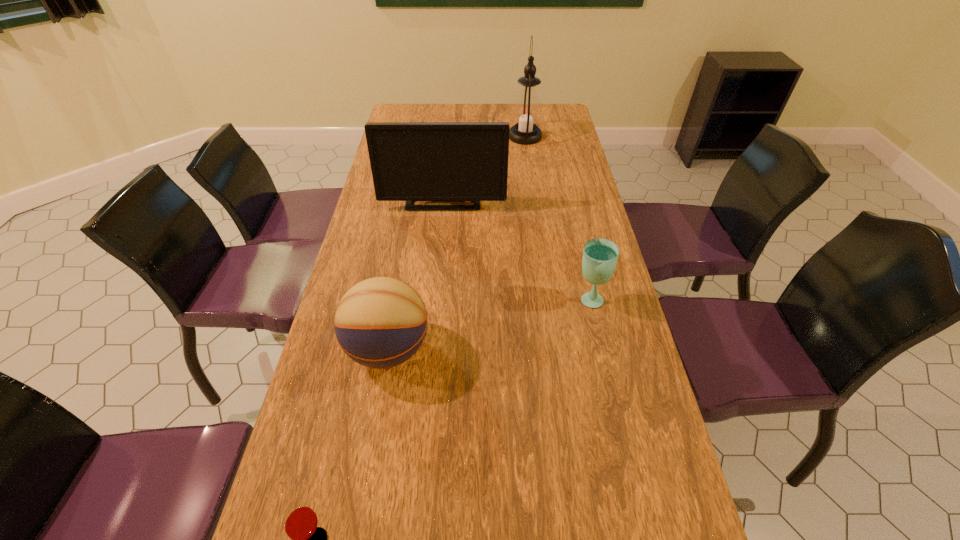
Locate an element on the screen. This screenshot has width=960, height=540. free space located on the left of the right glass is located at coordinates (479, 299).

Where is `object present at the far edge`? object present at the far edge is located at coordinates (527, 110).

This screenshot has height=540, width=960. Find the location of `computer monitor present at the left edge`. computer monitor present at the left edge is located at coordinates (410, 161).

I want to click on basketball located in the left edge section of the desktop, so click(x=381, y=322).

You are a GUI agent. You are given a task and a screenshot of the screen. Output one action in this format:
    pyautogui.click(x=<x>, y=<y>)
    Task: Click on the oil lamp located in the right edge section of the desktop
    This screenshot has width=960, height=540.
    Given the screenshot: What is the action you would take?
    pyautogui.click(x=527, y=110)

Find the location of a particular element. This screenshot has width=960, height=540. glass at the right edge is located at coordinates (600, 256).

The image size is (960, 540). I want to click on object present at the far right corner, so (527, 110).

What are the coordinates of `free space at the far edge of the desktop` in the screenshot? It's located at pyautogui.click(x=498, y=103).

In the image, there is a desktop. Identify the location of vacant space at the left edge. (376, 380).

This screenshot has height=540, width=960. In order to click on free space at the right edge of the desktop in this screenshot , I will do `click(541, 144)`.